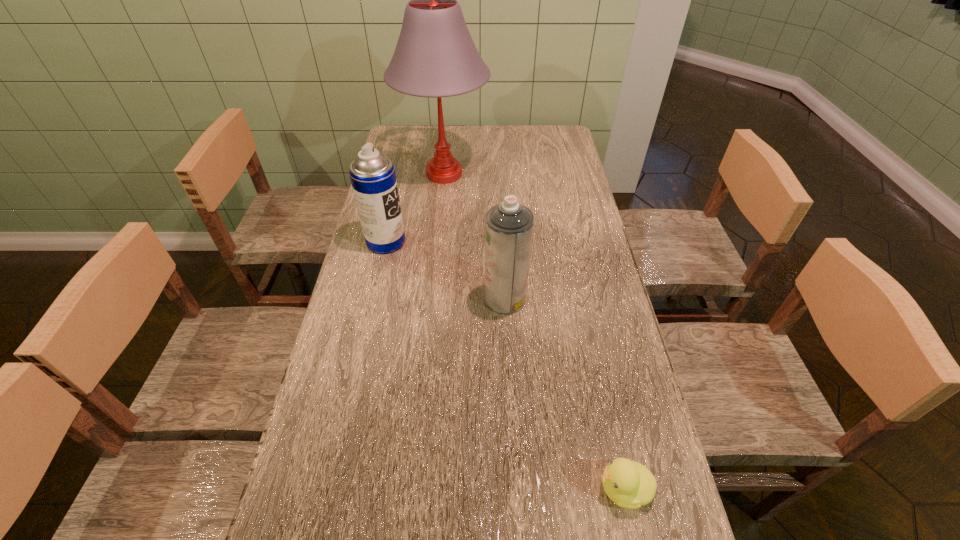
Locate an element on the screen. This screenshot has width=960, height=540. table lamp is located at coordinates coord(435,56).

Identify the location of the tallest object. The height and width of the screenshot is (540, 960). (435, 56).

At what (x,y) coordinates should I click in order to perform the action: click on the nearer aerosol can. Please return your answer as a coordinate pair (x, y). This screenshot has height=540, width=960. Looking at the image, I should click on (509, 225).

Identify the location of the second nearest object. The image size is (960, 540). (509, 225).

Identify the location of the third nearest object. This screenshot has width=960, height=540. (372, 174).

In order to click on the farther aerosol can in this screenshot , I will do `click(372, 174)`.

You are a GUI agent. You are given a task and a screenshot of the screen. Output one action in this format:
    pyautogui.click(x=<x>, y=<y>)
    Task: Click on the rightmost object
    The height and width of the screenshot is (540, 960).
    Given the screenshot: What is the action you would take?
    pyautogui.click(x=629, y=484)

This screenshot has width=960, height=540. What are the coordinates of `the nearest object` in the screenshot? It's located at (629, 484).

Find the location of a particular element. This screenshot has height=540, width=960. vacant space situated 0.310m on the front-facing side of the farthest object is located at coordinates (435, 262).

Image resolution: width=960 pixels, height=540 pixels. I want to click on free space located 0.310m on the left of the third farthest object, so pos(373,298).